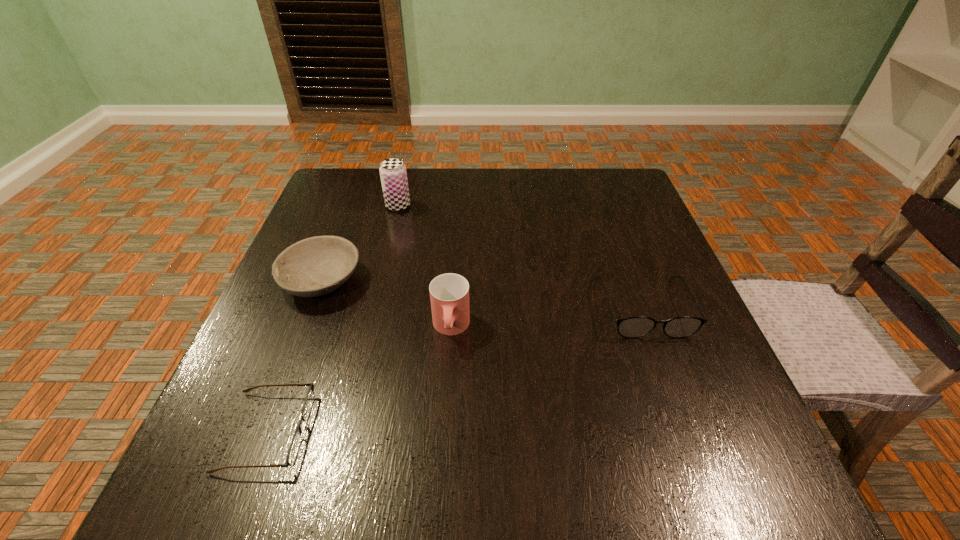
You are a GUI agent. You are given a task and a screenshot of the screen. Output one action in this format:
    pyautogui.click(x=<x>, y=<y>)
    Task: Click on the vacant area at the far edge of the desktop
    The width and height of the screenshot is (960, 540).
    Given the screenshot: What is the action you would take?
    pyautogui.click(x=540, y=198)

The height and width of the screenshot is (540, 960). I want to click on free space at the near edge, so click(x=559, y=489).

Identify the location of vacant space at the left edge of the desktop. This screenshot has width=960, height=540. (341, 307).

Locate an element on the screen. vacant area at the right edge of the desktop is located at coordinates (608, 244).

Find the location of a particular element. This screenshot has height=540, width=960. free space at the far right corner of the desktop is located at coordinates (610, 182).

I want to click on free spot between the bowl and the shorter spectacles, so tap(294, 355).

Where is `vacant point located between the nearer spectacles and the farther spectacles`? vacant point located between the nearer spectacles and the farther spectacles is located at coordinates (455, 369).

Locate an element on the screen. This screenshot has width=960, height=540. vacant area between the bowl and the beer can is located at coordinates (360, 243).

Find the location of a particular element. The image size is (960, 540). free point between the bowl and the cup is located at coordinates (386, 303).

The width and height of the screenshot is (960, 540). I want to click on free space between the bowl and the taller spectacles, so click(482, 293).